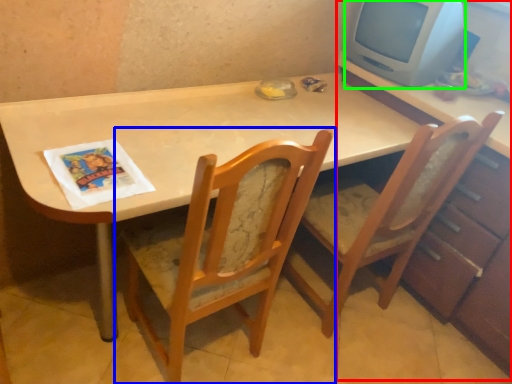
Question: Considering the real-world distances, which object is closest to dresser (highlighted by a red box)? chair (highlighted by a blue box) or computer monitor (highlighted by a green box).

Choices:
 (A) chair
 (B) computer monitor

Answer: (B)